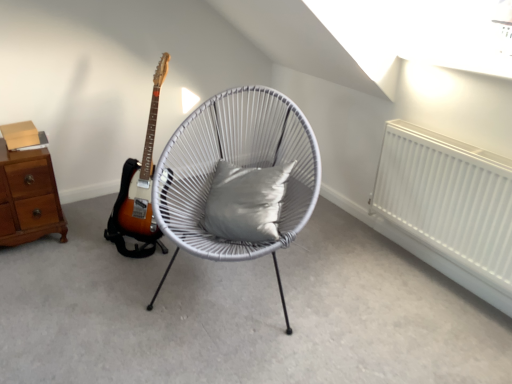
Find the location of a particular element. This screenshot has height=384, width=512. vacant area located to the right-hand side of white woven chair at center is located at coordinates (374, 290).